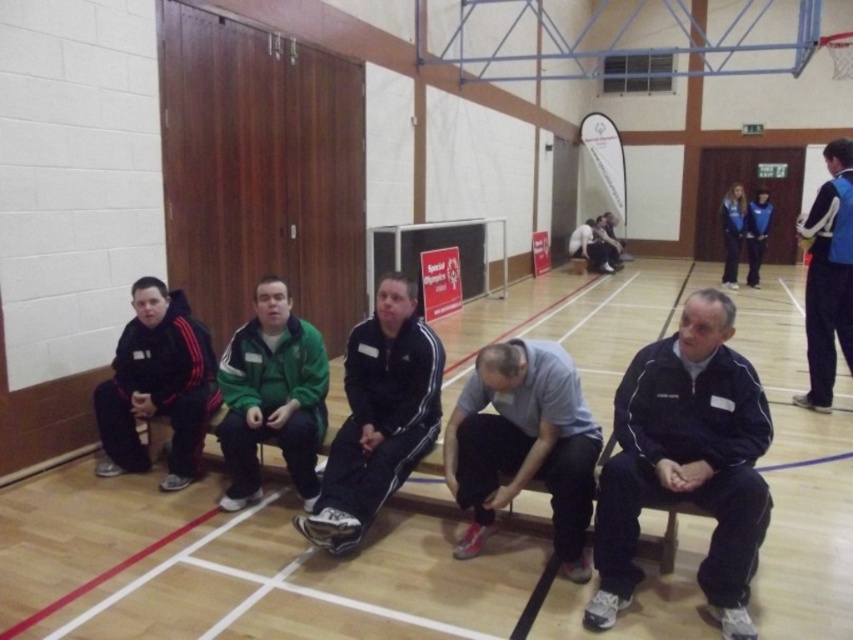
You are a photographer standing 5 feet away from the bench. You want to capture a photo of both the black adidas tracksuit at center and the black fleece jacket at left in the same frame. Given that your camera has a maximum focal length that allows capturing objects within a 4 feet distance range, will you be able to include both subjects in the photo?

The distance between the black adidas tracksuit at center and the black fleece jacket at left is 3.30 feet. Since your camera can capture within a 4 feet range and you are 5 feet away, the total span from you to both ends would be 5 feet plus half of 3.30 feet on each side. However, since the subjects are 3.30 feet apart from each other and within the 4 feet capture range when considering their positions relative to your position, both can fit in the frame.

You are a photographer setting up for a group photo at the gymnasium. You notice the green fleece jacket at center and the blue fabric jacket at right. Which jacket should you adjust to ensure both jackets appear equally tall in the photo?

The green fleece jacket at center has a lesser height compared to the blue fabric jacket at right. To make them appear equally tall, you should adjust the green fleece jacket at center by raising its position or angle in the frame.

You are a photographer standing in front of the bench where the green fleece jacket at center and the blue fabric jacket at right are placed. You want to take a photo that includes both jackets but focuses on the one on the right. Which jacket should you adjust your camera angle to capture better?

The blue fabric jacket at right is on the right side, so adjusting the camera angle towards the right will better capture it while still including the green fleece jacket at center.